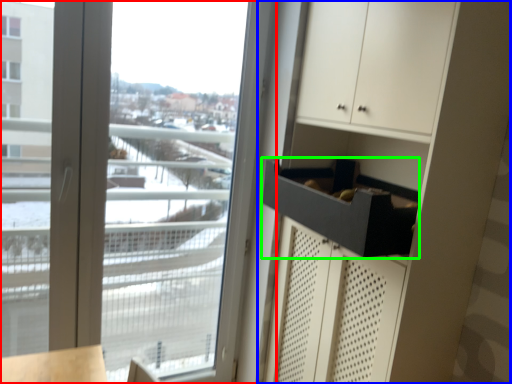
Question: Considering the real-world distances, which object is closest to window (highlighted by a red box)? dresser (highlighted by a blue box) or drawer (highlighted by a green box).

Choices:
 (A) dresser
 (B) drawer

Answer: (A)